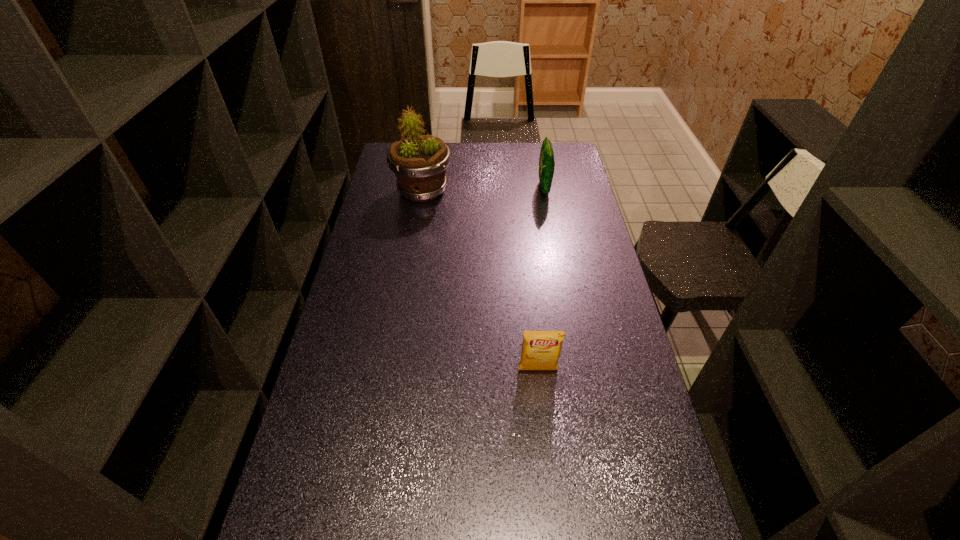
The image size is (960, 540). Find the location of `free space between the right crisp (potato chip) and the tallest object`. free space between the right crisp (potato chip) and the tallest object is located at coordinates (483, 190).

At what (x,y) coordinates should I click in order to perform the action: click on vacant point located between the left crisp (potato chip) and the tallest object. Please return your answer as a coordinate pair (x, y). The image size is (960, 540). Looking at the image, I should click on (480, 281).

This screenshot has height=540, width=960. Find the location of `vacant space that's between the rightmost object and the nearest object`. vacant space that's between the rightmost object and the nearest object is located at coordinates (541, 279).

Identify which object is the nearest to the second object from right to left. Please provide its 2D coordinates. Your answer should be formatted as a tuple, i.e. [(x, y)], where the tuple contains the x and y coordinates of a point satisfying the conditions above.

[(419, 162)]

Locate which object is the closest to the tallest object. Please provide its 2D coordinates. Your answer should be formatted as a tuple, i.e. [(x, y)], where the tuple contains the x and y coordinates of a point satisfying the conditions above.

[(546, 160)]

Where is `free space that satisfies the following two spatial constraints: 1. on the front-facing side of the farther crisp (potato chip); 2. on the front side of the tallest object`? Image resolution: width=960 pixels, height=540 pixels. free space that satisfies the following two spatial constraints: 1. on the front-facing side of the farther crisp (potato chip); 2. on the front side of the tallest object is located at coordinates (544, 191).

Where is `blank area in the image that satisfies the following two spatial constraints: 1. on the front-facing side of the farther crisp (potato chip); 2. on the front of the shortest object with the logo`? blank area in the image that satisfies the following two spatial constraints: 1. on the front-facing side of the farther crisp (potato chip); 2. on the front of the shortest object with the logo is located at coordinates (577, 370).